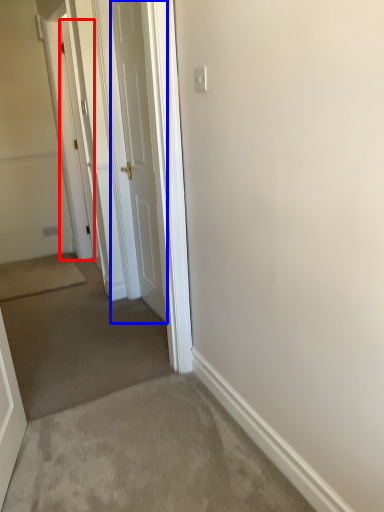
Question: Which point is further to the camera, door (highlighted by a red box) or door (highlighted by a blue box)?

Choices:
 (A) door
 (B) door

Answer: (A)